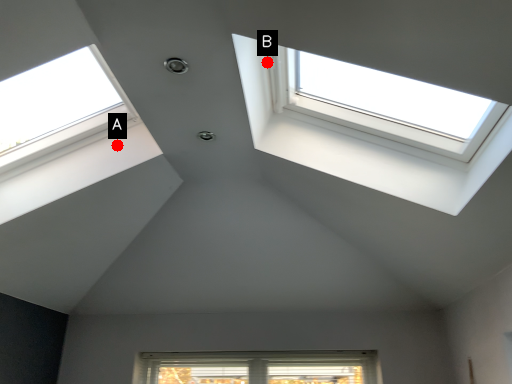
Question: Two points are circled on the image, labeled by A and B beside each circle. Which of the following is the closest to the observer?

Choices:
 (A) A is closer
 (B) B is closer

Answer: (B)